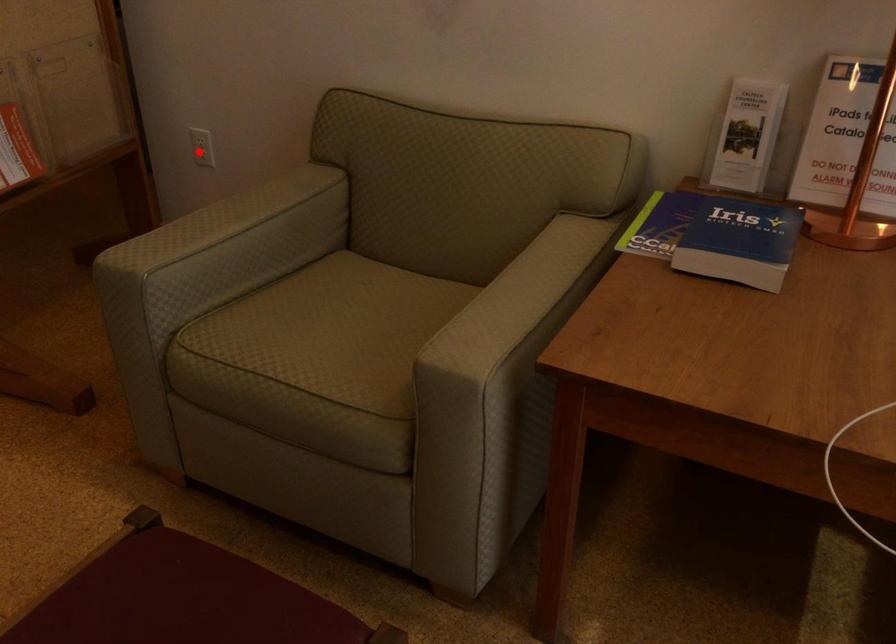
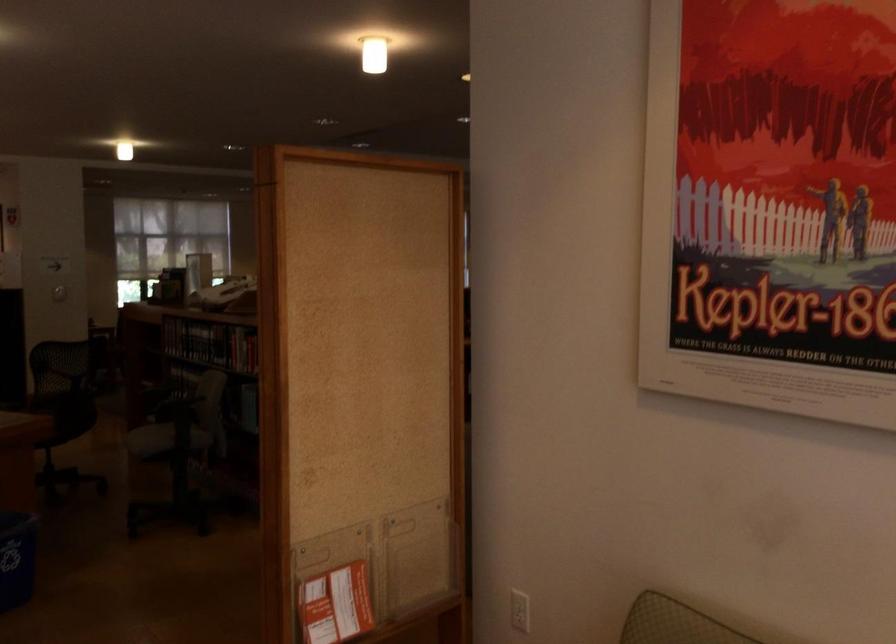
In the second image, find the point that corresponds to the highlighted location in the first image.

(520, 610)